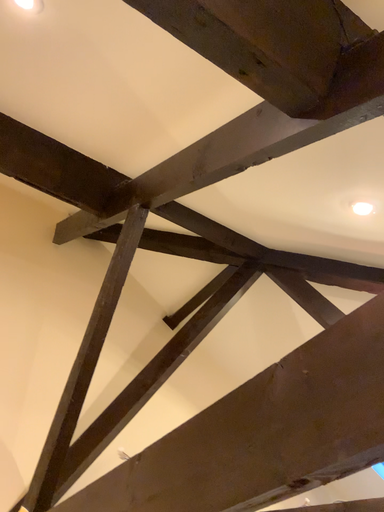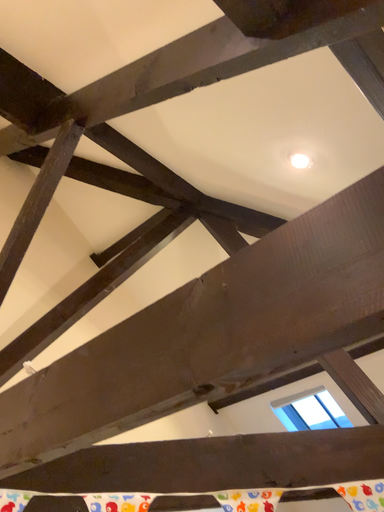
Question: How did the camera likely rotate when shooting the video?

Choices:
 (A) rotated right
 (B) rotated left

Answer: (A)